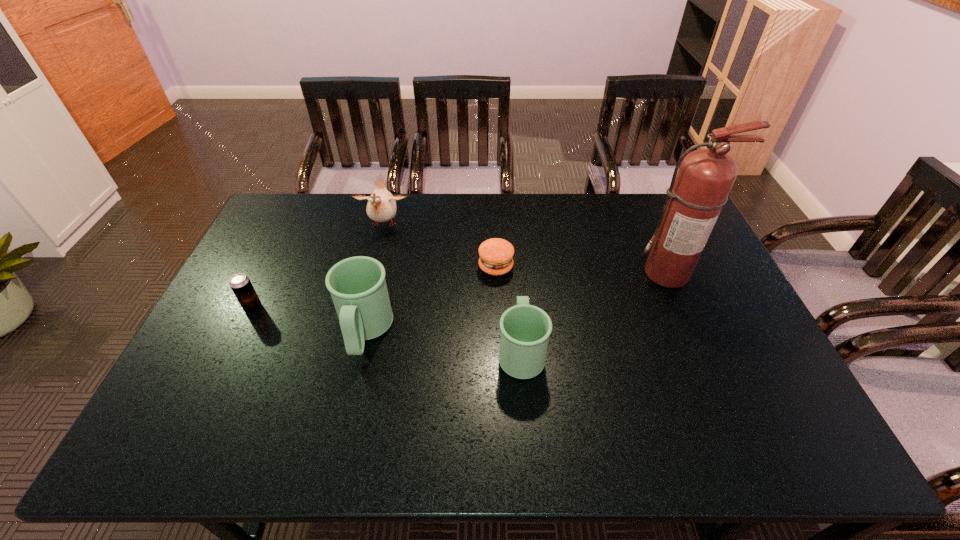
At what (x,y) coordinates should I click in order to perform the action: click on vacant area at the far edge. Please return your answer as a coordinate pair (x, y). The width and height of the screenshot is (960, 540). Looking at the image, I should click on (571, 227).

At what (x,y) coordinates should I click in order to perform the action: click on free region at the near edge. Please return your answer as a coordinate pair (x, y). This screenshot has height=540, width=960. Looking at the image, I should click on (629, 384).

In the image, there is a desktop. Identify the location of vacant area at the left edge. The image size is (960, 540). (270, 252).

The height and width of the screenshot is (540, 960). What are the coordinates of `free region at the right edge` in the screenshot? It's located at (709, 255).

The image size is (960, 540). Find the location of `vacant space at the far left corner of the desktop`. vacant space at the far left corner of the desktop is located at coordinates (279, 212).

I want to click on vacant region between the left mug and the leftmost object, so click(x=309, y=320).

You are a GUI agent. You are given a task and a screenshot of the screen. Output one action in this format:
    pyautogui.click(x=<x>, y=<y>)
    Task: Click on the blank region between the fifth tallest object and the farthest object
    Image resolution: width=960 pixels, height=540 pixels.
    Given the screenshot: What is the action you would take?
    pyautogui.click(x=319, y=267)

I want to click on unoccupied area between the shorter mug and the rightmost object, so click(x=594, y=312).

Find the location of a particular element. The height and width of the screenshot is (540, 960). vacant space that is in between the farthest object and the patty is located at coordinates (440, 246).

This screenshot has height=540, width=960. Find the location of `empty space that is in between the shorter mug and the fire extinguisher`. empty space that is in between the shorter mug and the fire extinguisher is located at coordinates (594, 312).